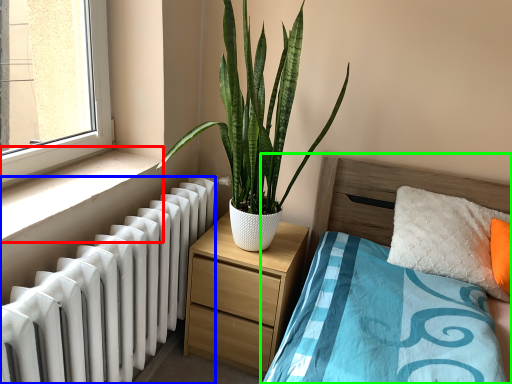
Question: Which object is the farthest from window sill (highlighted by a red box)? Choose among these: radiator (highlighted by a blue box) or bed (highlighted by a green box).

Choices:
 (A) radiator
 (B) bed

Answer: (B)